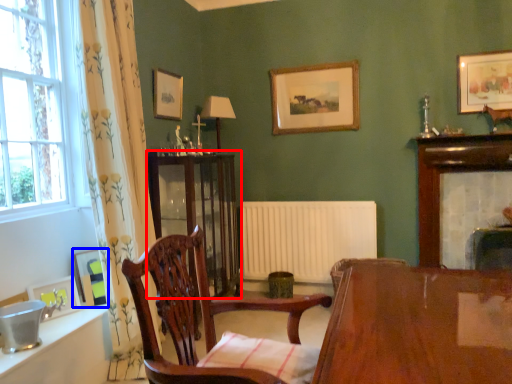
Question: Which object is closer to the camera taking this photo, cabinetry (highlighted by a red box) or picture frame (highlighted by a blue box)?

Choices:
 (A) cabinetry
 (B) picture frame

Answer: (B)